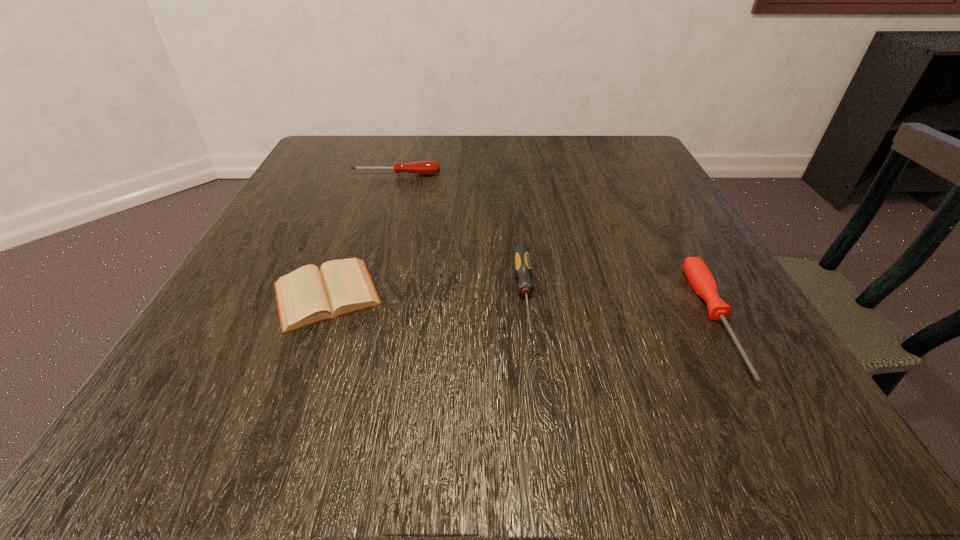
Image resolution: width=960 pixels, height=540 pixels. In order to click on vacant area between the rightmost screwdriver and the diary in this screenshot , I will do `click(521, 307)`.

The image size is (960, 540). I want to click on the closest object to the rightmost object, so click(523, 269).

Identify the location of the second closest object relative to the third object from left to right. This screenshot has width=960, height=540. (700, 278).

Identify which screwdriver is the second closest to the farthest object. Please provide its 2D coordinates. Your answer should be formatted as a tuple, i.e. [(x, y)], where the tuple contains the x and y coordinates of a point satisfying the conditions above.

[(700, 278)]

The image size is (960, 540). I want to click on screwdriver that can be found as the closest to the rightmost object, so click(523, 269).